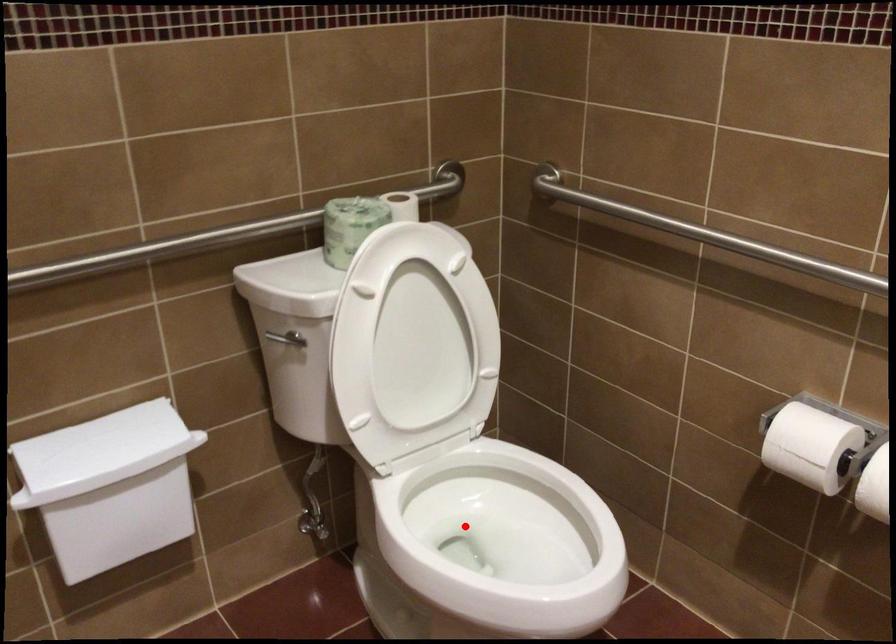
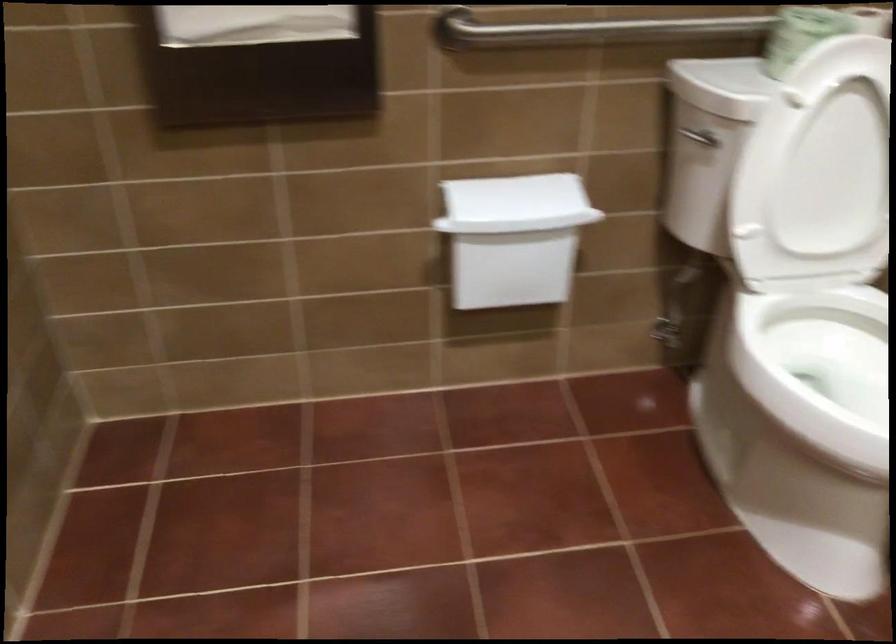
Find the pixel in the second image that matches the highlighted location in the first image.

(819, 368)